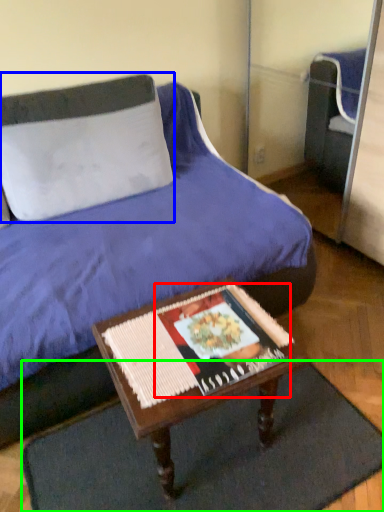
Question: Which object is the closest to the magazine (highlighted by a red box)? Choose among these: pillow (highlighted by a blue box) or doormat (highlighted by a green box).

Choices:
 (A) pillow
 (B) doormat

Answer: (B)